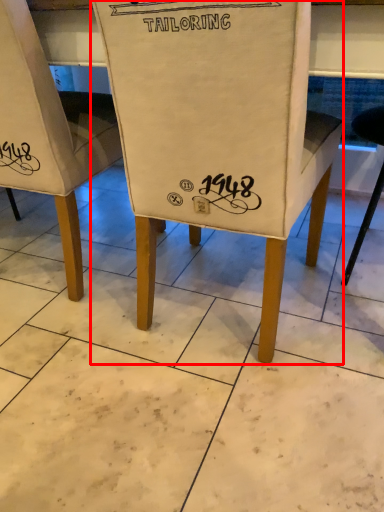
Question: From the image's perspective, what is the correct spatial positioning of chair (annotated by the red box) in reference to chair?

Choices:
 (A) above
 (B) below

Answer: (B)